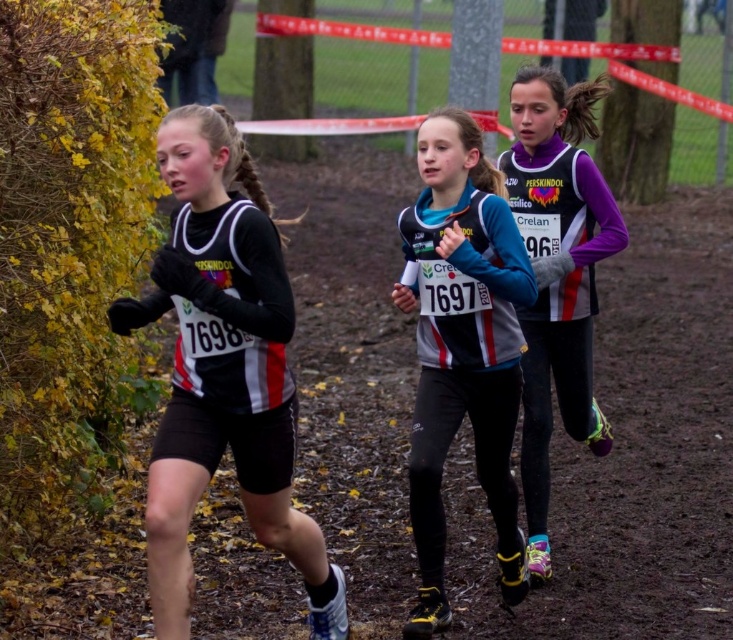
Question: Among these objects, which one is nearest to the camera?

Choices:
 (A) matte black running suit at left
 (B) brown dirt track at center
 (C) purple matte vest at center

Answer: (A)

Question: Does matte black running suit at left have a greater width compared to gray fabric jacket at center?

Choices:
 (A) no
 (B) yes

Answer: (B)

Question: Considering the relative positions of brown dirt track at center and matte black running suit at left in the image provided, where is brown dirt track at center located with respect to matte black running suit at left?

Choices:
 (A) left
 (B) right

Answer: (B)

Question: Which of the following is the farthest from the observer?

Choices:
 (A) (424, 188)
 (B) (169, 557)
 (C) (688, 452)
 (D) (530, 346)

Answer: (A)

Question: Is gray fabric jacket at center bigger than purple matte vest at center?

Choices:
 (A) yes
 (B) no

Answer: (B)

Question: Among these points, which one is farthest from the camera?

Choices:
 (A) (x=478, y=276)
 (B) (x=188, y=321)
 (C) (x=545, y=428)
 (D) (x=316, y=234)

Answer: (D)